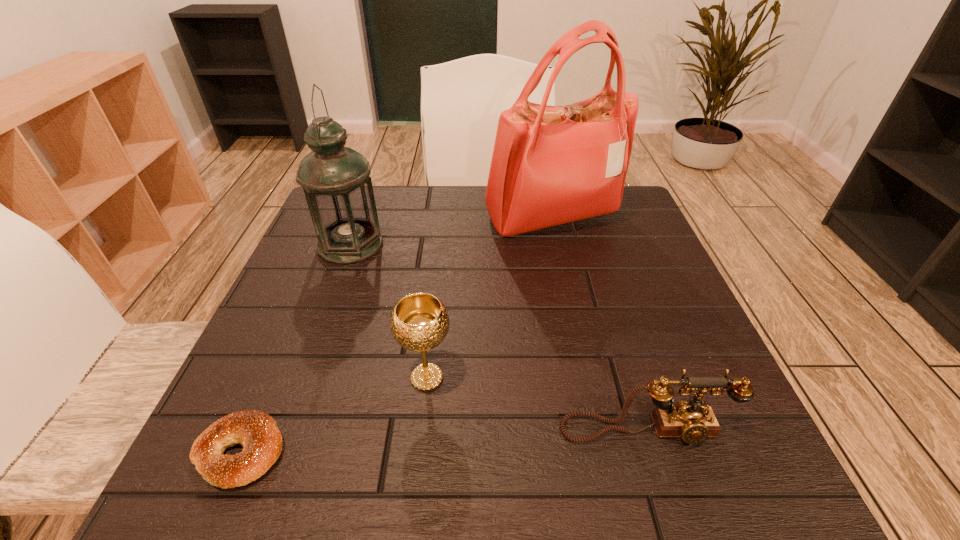
You are a GUI agent. You are given a task and a screenshot of the screen. Output one action in this format:
    pyautogui.click(x=<x>, y=<y>)
    Task: Click on the tallest object
    This screenshot has height=540, width=960.
    Given the screenshot: What is the action you would take?
    pyautogui.click(x=551, y=165)

I want to click on the fourth shortest object, so click(x=336, y=181).

Where is `the third object from right to left`? The width and height of the screenshot is (960, 540). the third object from right to left is located at coordinates (419, 322).

Where is `the third tallest object`? The width and height of the screenshot is (960, 540). the third tallest object is located at coordinates (419, 322).

Where is `the fourth tallest object`? the fourth tallest object is located at coordinates (693, 422).

Find the location of a particular element. the shortest object is located at coordinates (257, 432).

This screenshot has width=960, height=540. Find the location of `vacant space located 0.140m on the front-facing side of the tallest object`. vacant space located 0.140m on the front-facing side of the tallest object is located at coordinates (567, 289).

The width and height of the screenshot is (960, 540). Find the location of `vacant area situated on the back of the oil lamp`. vacant area situated on the back of the oil lamp is located at coordinates (372, 186).

The height and width of the screenshot is (540, 960). I want to click on vacant space situated 0.350m on the right of the third farthest object, so click(x=662, y=377).

Locate an element on the screen. blank space located 0.060m on the front-facing side of the telephone is located at coordinates click(663, 489).